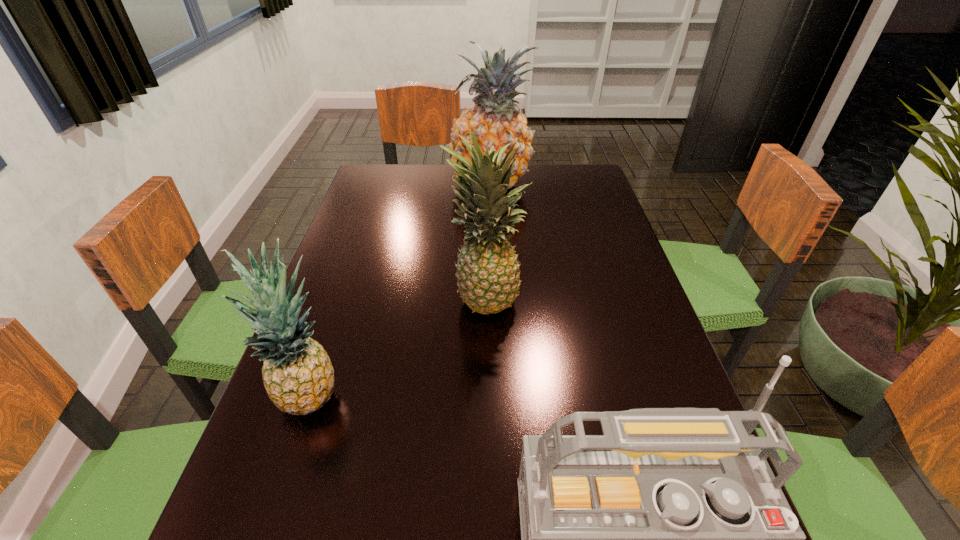
Where is `free space at the right edge of the desktop`? This screenshot has width=960, height=540. free space at the right edge of the desktop is located at coordinates (562, 234).

In order to click on vacant space at the far left corner in this screenshot , I will do `click(372, 179)`.

In the image, there is a desktop. In order to click on vacant space at the far right corner in this screenshot , I will do `click(572, 187)`.

Identify the location of empty location between the third nearest object and the leftmost pineapple. (397, 345).

You are a GUI agent. You are given a task and a screenshot of the screen. Output one action in this format:
    pyautogui.click(x=<x>, y=<y>)
    Task: Click on the vacant space that's between the nearest pineapple and the farthest pineapple
    This screenshot has width=960, height=540.
    Given the screenshot: What is the action you would take?
    [400, 290]

Find the location of a particular element. This screenshot has width=960, height=540. free space between the third nearest object and the leftmost object is located at coordinates (397, 345).

Choose which object is the third nearest neighbor to the third nearest object. Please provide its 2D coordinates. Your answer should be formatted as a tuple, i.e. [(x, y)], where the tuple contains the x and y coordinates of a point satisfying the conditions above.

[(668, 539)]

Identify which object is located as the nearest to the farthest object. Please provide its 2D coordinates. Your answer should be formatted as a tuple, i.e. [(x, y)], where the tuple contains the x and y coordinates of a point satisfying the conditions above.

[(488, 273)]

This screenshot has width=960, height=540. Identify the location of pineapple that is the second closest to the leftmost object. coord(495,120).

Image resolution: width=960 pixels, height=540 pixels. I want to click on pineapple object that ranks as the second closest to the shortest pineapple, so click(x=495, y=120).